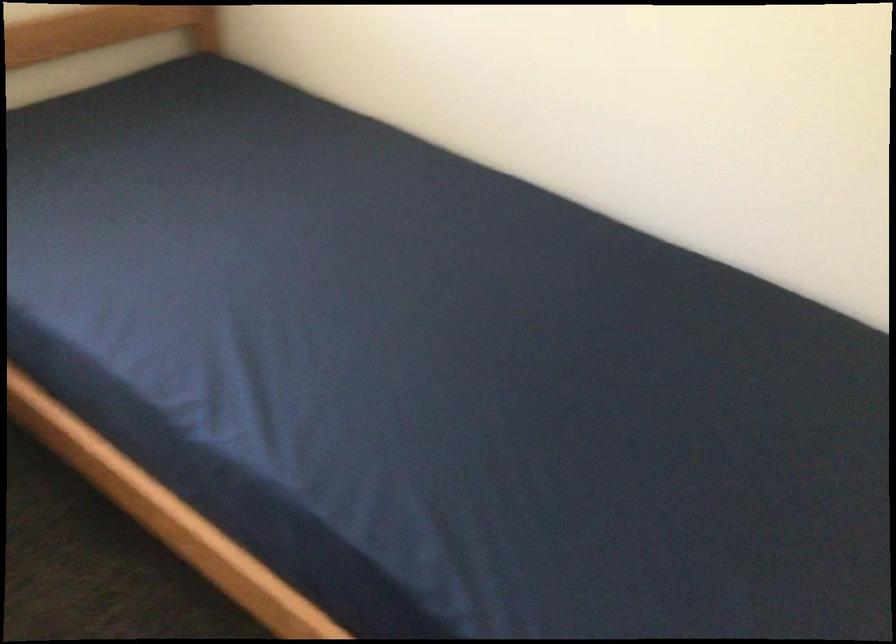
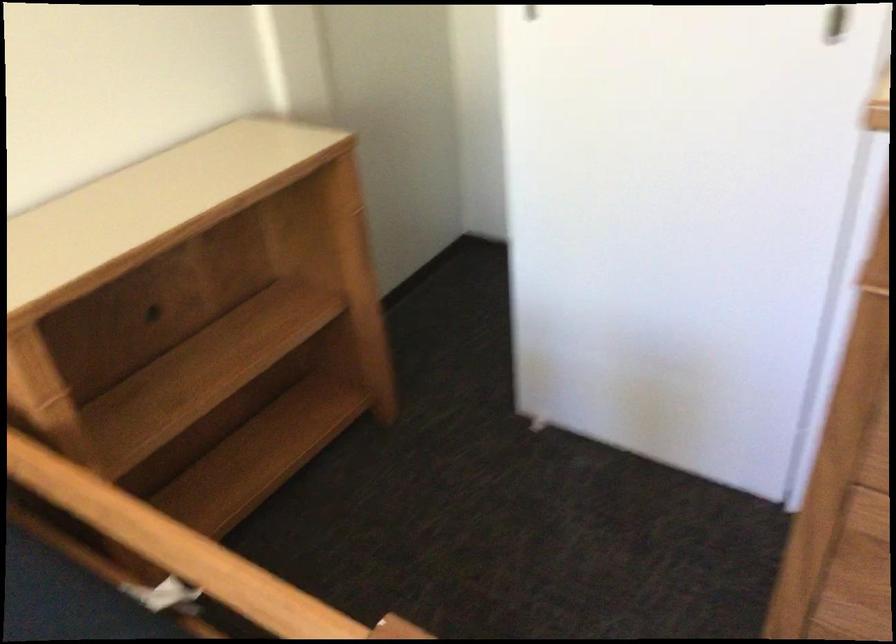
How did the camera likely rotate?

The camera's rotation is toward right-down.